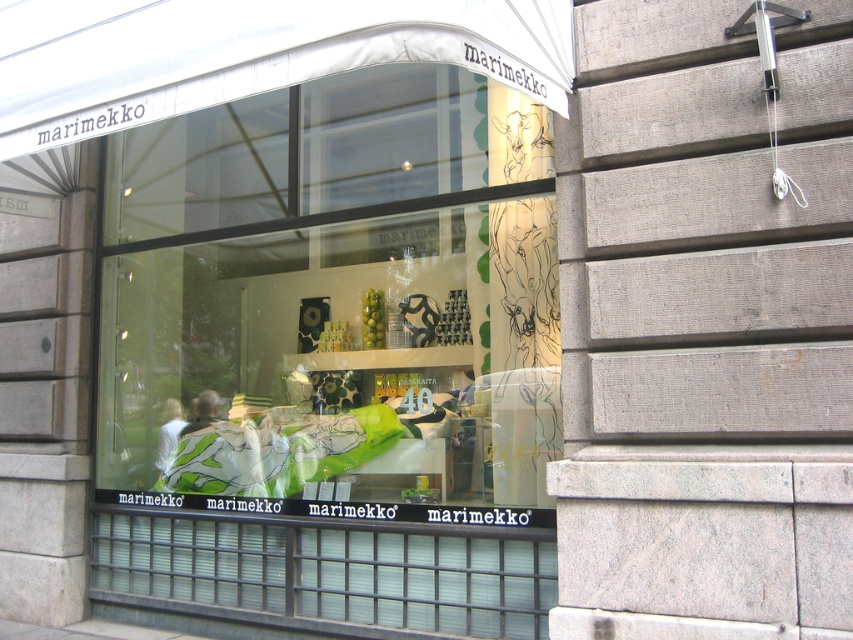
Question: Does green fabric pillows at center have a greater width compared to matte green fabric at center?

Choices:
 (A) yes
 (B) no

Answer: (A)

Question: Considering the relative positions of green fabric pillows at center and matte green fabric at center in the image provided, where is green fabric pillows at center located with respect to matte green fabric at center?

Choices:
 (A) below
 (B) above

Answer: (B)

Question: Which point is closer to the camera?

Choices:
 (A) green fabric pillows at center
 (B) matte green fabric at center

Answer: (A)

Question: Does green fabric pillows at center have a lesser width compared to matte green fabric at center?

Choices:
 (A) no
 (B) yes

Answer: (A)